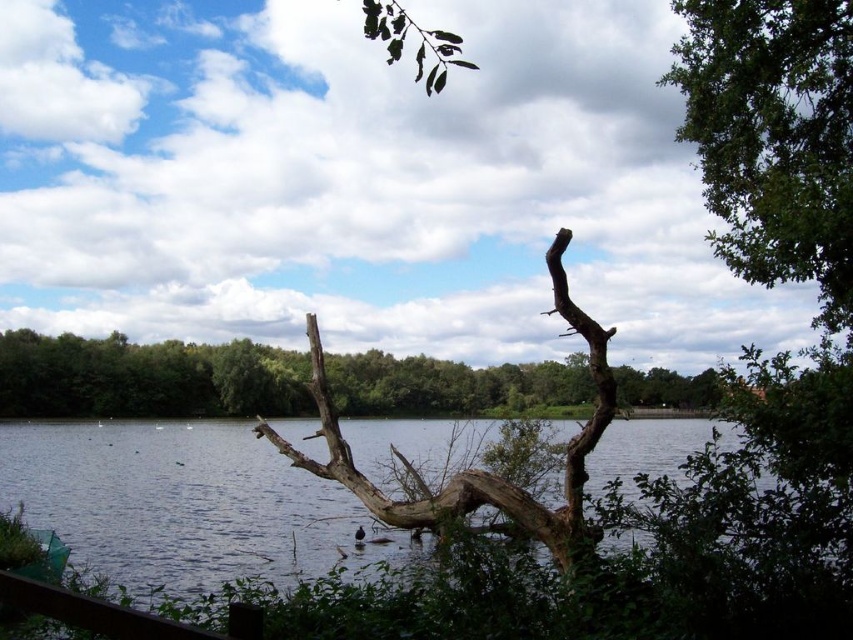
You are an observer looking at the serene lakeside scene. You notice the green leafy tree at upper right and the brown rough wood at center. Which object is positioned higher in the image?

The green leafy tree at upper right is located above the brown rough wood at center, so it is positioned higher in the image.

You are standing at the center of the image and want to locate the green leafy tree at upper right. Which direction should you look to find it?

The green leafy tree at upper right is located at point coordinates of (775, 138), so you should look towards the upper right direction to find it.

You are standing at the edge of the lake and see the point marked at coordinates (x=146, y=378). According to the scene, where exactly is this point located?

The point at coordinates (x=146, y=378) is located on the brown rough tree trunk at center.